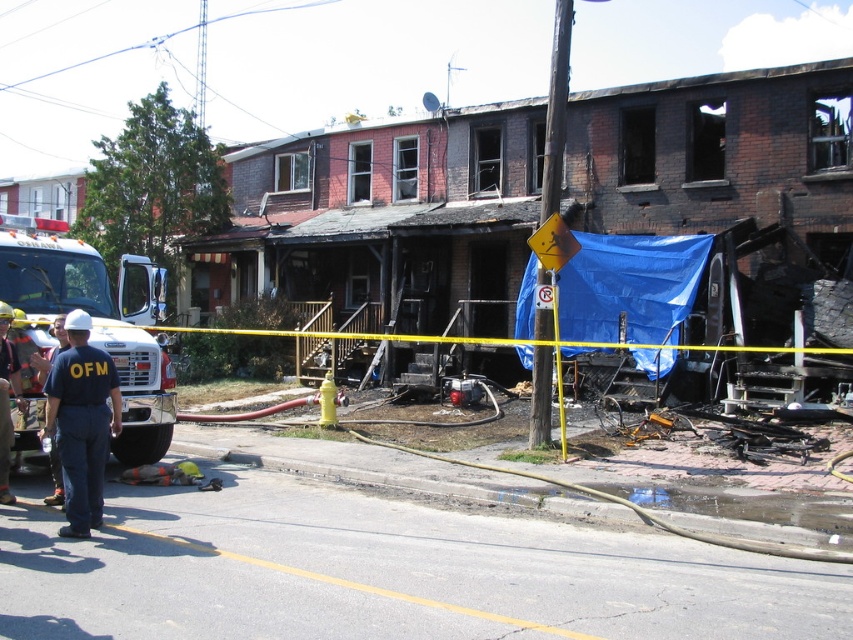
Is point (44, 221) more distant than point (103, 413)?

Yes, point (44, 221) is farther from viewer.

Does point (15, 301) lie in front of point (80, 401)?

No, it is not.

The image size is (853, 640). What are the coordinates of `white glossy fire truck at left` in the screenshot? It's located at (96, 321).